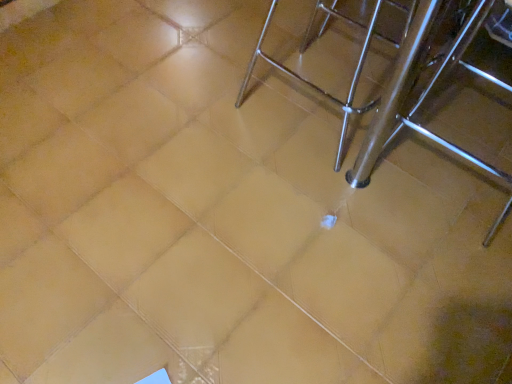
The width and height of the screenshot is (512, 384). In order to click on silver metallic stool at center in this screenshot , I will do `click(395, 84)`.

The height and width of the screenshot is (384, 512). Describe the element at coordinates (395, 84) in the screenshot. I see `silver metallic stool at center` at that location.

Describe the element at coordinates (315, 85) in the screenshot. I see `polished metal chair at upper right` at that location.

Identify the location of polished metal chair at upper right. (315, 85).

In order to face polished metal chair at upper right, should I rotate leftwards or rightwards?

Turn right approximately 10.835 degrees to face it.

You are a GUI agent. You are given a task and a screenshot of the screen. Output one action in this format:
    pyautogui.click(x=<x>, y=<y>)
    Task: Click on the silver metallic stool at center
    The width and height of the screenshot is (512, 384).
    Given the screenshot: What is the action you would take?
    pyautogui.click(x=395, y=84)

Looking at this image, is polished metal chair at upper right to the left of silver metallic stool at center from the viewer's perspective?

Yes, polished metal chair at upper right is to the left of silver metallic stool at center.

Considering their positions, is polished metal chair at upper right located in front of or behind silver metallic stool at center?

In the image, polished metal chair at upper right appears behind silver metallic stool at center.

Which is in front, point (380, 1) or point (422, 130)?

The point (422, 130) is more forward.

From the image's perspective, between polished metal chair at upper right and silver metallic stool at center, which one is located above?

silver metallic stool at center, from the image's perspective.

From a real-world perspective, does polished metal chair at upper right stand above silver metallic stool at center?

No.

Consider the image. Considering the sizes of polished metal chair at upper right and silver metallic stool at center in the image, is polished metal chair at upper right wider or thinner than silver metallic stool at center?

In the image, polished metal chair at upper right appears to be more narrow than silver metallic stool at center.

Can you confirm if polished metal chair at upper right is taller than silver metallic stool at center?

Incorrect, the height of polished metal chair at upper right is not larger of that of silver metallic stool at center.

Looking at the image, does polished metal chair at upper right seem bigger or smaller compared to silver metallic stool at center?

polished metal chair at upper right is smaller than silver metallic stool at center.

Can we say polished metal chair at upper right lies outside silver metallic stool at center?

No, most part of polished metal chair at upper right lies within silver metallic stool at center.

Is polished metal chair at upper right not near silver metallic stool at center?

No, there isn't a large distance between polished metal chair at upper right and silver metallic stool at center.

Could you tell me if polished metal chair at upper right is turned towards silver metallic stool at center?

Yes, polished metal chair at upper right faces towards silver metallic stool at center.

How many degrees apart are the facing directions of polished metal chair at upper right and silver metallic stool at center?

92.4 degrees separate the facing orientations of polished metal chair at upper right and silver metallic stool at center.

Where is `chair lying on the left of silver metallic stool at center`? This screenshot has width=512, height=384. chair lying on the left of silver metallic stool at center is located at coordinates click(x=315, y=85).

Which object is positioned more to the left, silver metallic stool at center or polished metal chair at upper right?

polished metal chair at upper right is more to the left.

Is silver metallic stool at center further to camera compared to polished metal chair at upper right?

No, silver metallic stool at center is in front of polished metal chair at upper right.

Is point (398, 57) less distant than point (366, 111)?

No.

From the image's perspective, is silver metallic stool at center above or below polished metal chair at upper right?

Based on their image positions, silver metallic stool at center is located above polished metal chair at upper right.

From a real-world perspective, is silver metallic stool at center above or below polished metal chair at upper right?

In terms of real-world spatial position, silver metallic stool at center is above polished metal chair at upper right.

In terms of width, does silver metallic stool at center look wider or thinner when compared to polished metal chair at upper right?

Considering their sizes, silver metallic stool at center looks broader than polished metal chair at upper right.

Does silver metallic stool at center have a lesser height compared to polished metal chair at upper right?

No, silver metallic stool at center is not shorter than polished metal chair at upper right.

In terms of size, does silver metallic stool at center appear bigger or smaller than polished metal chair at upper right?

In the image, silver metallic stool at center appears to be larger than polished metal chair at upper right.

Can we say silver metallic stool at center lies outside polished metal chair at upper right?

Indeed, silver metallic stool at center is completely outside polished metal chair at upper right.

Would you say silver metallic stool at center is a long distance from polished metal chair at upper right?

No, silver metallic stool at center is not far away from polished metal chair at upper right.

Is silver metallic stool at center turned away from polished metal chair at upper right?

No, silver metallic stool at center's orientation is not away from polished metal chair at upper right.

How much distance is there between silver metallic stool at center and polished metal chair at upper right?

They are 4.12 inches apart.

Locate an element on the screen. chair that is behind the silver metallic stool at center is located at coordinates (315, 85).

Locate an element on the screen. This screenshot has width=512, height=384. chair on the left of silver metallic stool at center is located at coordinates (315, 85).

Locate an element on the screen. The height and width of the screenshot is (384, 512). furniture positioned vertically above the polished metal chair at upper right (from a real-world perspective) is located at coordinates (395, 84).